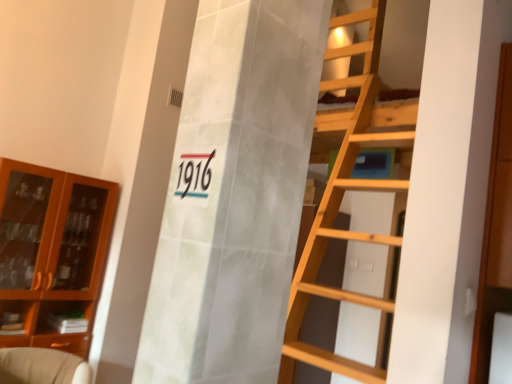
Question: Considering the relative sizes of wooden cabinet at right, arranged as the 2th cabinetry when viewed from the left, and black glossy number at center in the image provided, is wooden cabinet at right, arranged as the 2th cabinetry when viewed from the left, taller than black glossy number at center?

Choices:
 (A) yes
 (B) no

Answer: (A)

Question: Is wooden cabinet at right, which is the first cabinetry in right-to-left order, looking in the opposite direction of black glossy number at center?

Choices:
 (A) yes
 (B) no

Answer: (B)

Question: From the image's perspective, is wooden cabinet at right, which ranks as the 2th cabinetry in back-to-front order, on top of black glossy number at center?

Choices:
 (A) yes
 (B) no

Answer: (B)

Question: Is black glossy number at center surrounded by wooden cabinet at right, which appears as the first cabinetry when viewed from the front?

Choices:
 (A) yes
 (B) no

Answer: (B)

Question: Does wooden cabinet at right, which is the first cabinetry in right-to-left order, have a lesser height compared to black glossy number at center?

Choices:
 (A) no
 (B) yes

Answer: (A)

Question: Is black glossy number at center in front of or behind beige fabric armchair at lower left in the image?

Choices:
 (A) front
 (B) behind

Answer: (A)

Question: Is point (182, 162) positioned closer to the camera than point (80, 367)?

Choices:
 (A) closer
 (B) farther

Answer: (A)

Question: From the image's perspective, relative to beige fabric armchair at lower left, is black glossy number at center above or below?

Choices:
 (A) above
 (B) below

Answer: (A)

Question: Is black glossy number at center wider or thinner than beige fabric armchair at lower left?

Choices:
 (A) thin
 (B) wide

Answer: (A)

Question: In terms of size, does wooden cabinet at right, which ranks as the 2th cabinetry in back-to-front order, appear bigger or smaller than black glossy number at center?

Choices:
 (A) small
 (B) big

Answer: (B)

Question: Is wooden cabinet at right, which appears as the first cabinetry when viewed from the front, in front of or behind black glossy number at center in the image?

Choices:
 (A) front
 (B) behind

Answer: (B)

Question: Does point (498, 261) appear closer or farther from the camera than point (193, 190)?

Choices:
 (A) farther
 (B) closer

Answer: (A)

Question: Would you say wooden cabinet at right, which is the first cabinetry in right-to-left order, is to the left or to the right of black glossy number at center in the picture?

Choices:
 (A) right
 (B) left

Answer: (A)

Question: Considering the positions of brown glass cabinet at left, which appears as the second cabinetry when viewed from the front, and beige fabric armchair at lower left in the image, is brown glass cabinet at left, which appears as the second cabinetry when viewed from the front, wider or thinner than beige fabric armchair at lower left?

Choices:
 (A) wide
 (B) thin

Answer: (B)

Question: Is brown glass cabinet at left, which appears as the second cabinetry when viewed from the front, taller or shorter than beige fabric armchair at lower left?

Choices:
 (A) tall
 (B) short

Answer: (A)